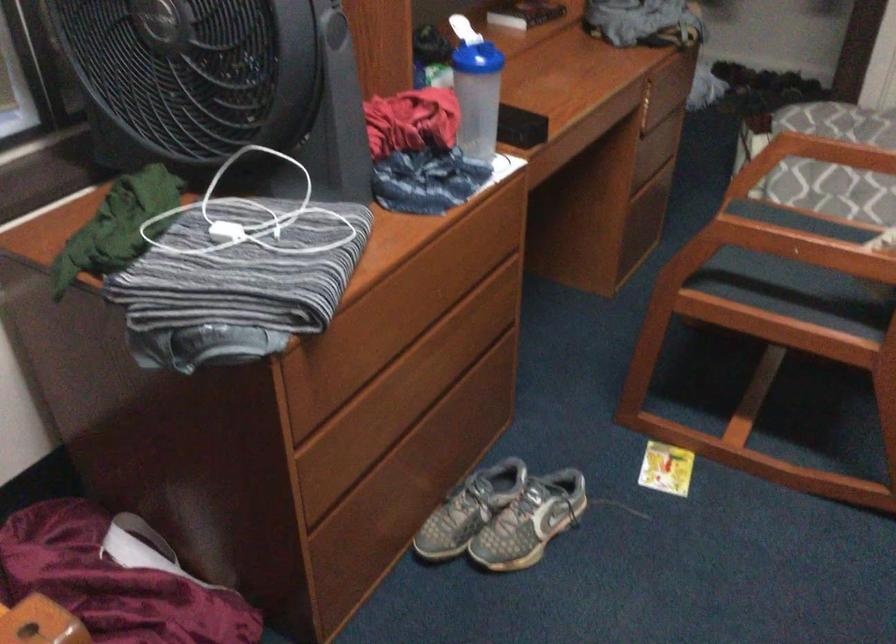
Find where to clos the bottle flip cap. Please return your answer as a coordinate pair (x, y).

(462, 29)